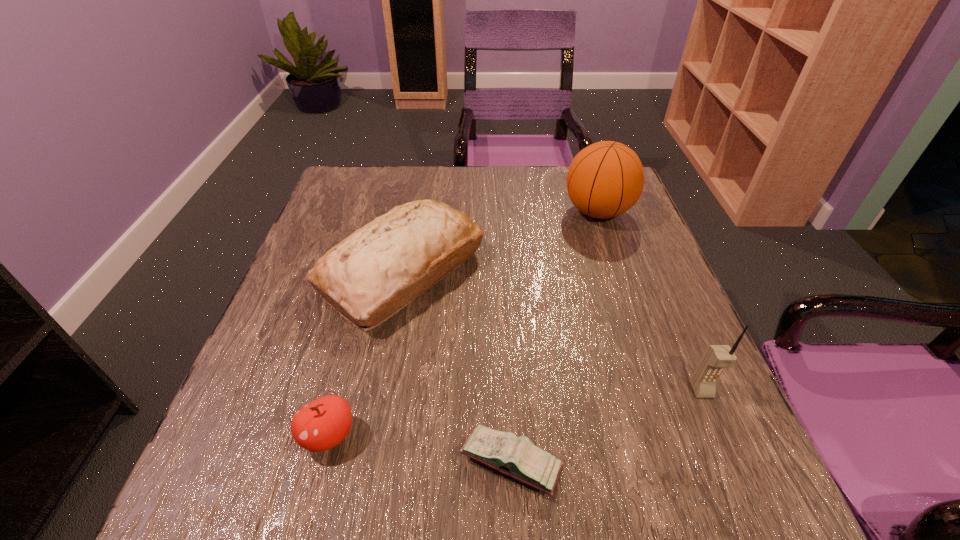
This screenshot has width=960, height=540. What are the coordinates of `basketball` in the screenshot? It's located at (605, 179).

This screenshot has width=960, height=540. Find the location of `cellular telephone`. cellular telephone is located at coordinates (716, 358).

What are the coordinates of `the third tallest object` in the screenshot? It's located at [376, 271].

Locate an element on the screen. This screenshot has height=540, width=960. the second shortest object is located at coordinates (322, 424).

This screenshot has width=960, height=540. In order to click on diary in this screenshot , I will do `click(517, 457)`.

In order to click on vacant area situated on the front of the basketball in this screenshot , I will do `click(635, 320)`.

The image size is (960, 540). I want to click on free region located on the front of the cellular telephone, where the keypad is located, so click(727, 451).

You are a GUI agent. You are given a task and a screenshot of the screen. Output one action in this format:
    pyautogui.click(x=<x>, y=<y>)
    Task: Click on the free space located on the right of the third tallest object
    
    Given the screenshot: What is the action you would take?
    pyautogui.click(x=598, y=272)

Locate an element on the screen. The image size is (960, 540). free space located on the back of the apple is located at coordinates (354, 340).

I want to click on vacant space situated on the back of the diary, so click(503, 300).